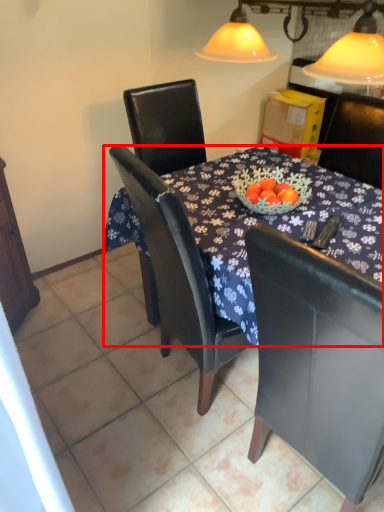
Question: Considering the relative positions of desk (annotated by the red box) and chair in the image provided, where is desk (annotated by the red box) located with respect to the staircase?

Choices:
 (A) right
 (B) left

Answer: (B)